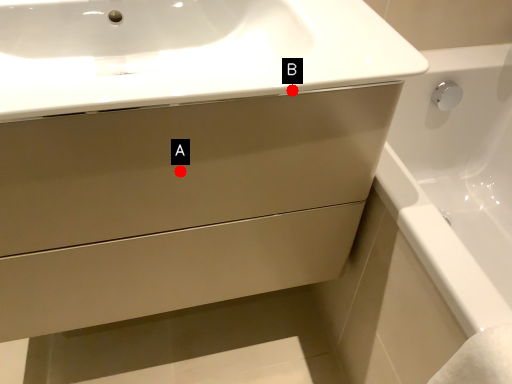
Question: Two points are circled on the image, labeled by A and B beside each circle. Which point is farther from the camera taking this photo?

Choices:
 (A) A is further
 (B) B is further

Answer: (A)